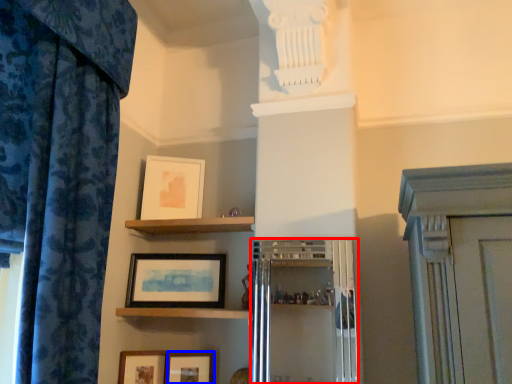
Question: Which point is further to the camera, cabinetry (highlighted by a red box) or picture frame (highlighted by a blue box)?

Choices:
 (A) cabinetry
 (B) picture frame

Answer: (B)